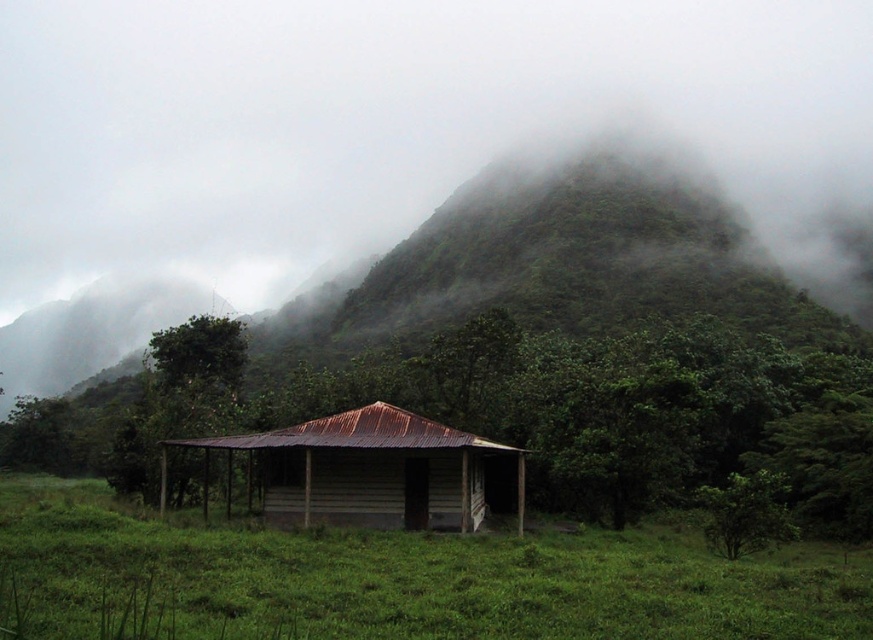
Question: Which of the following is the farthest from the observer?

Choices:
 (A) (418, 424)
 (B) (787, 372)
 (C) (636, 541)

Answer: (B)

Question: Can you confirm if green grassy at center is smaller than green matte mountain at center?

Choices:
 (A) no
 (B) yes

Answer: (B)

Question: Which object appears closest to the camera in this image?

Choices:
 (A) green matte/rough hut at center
 (B) green grassy at center
 (C) rusty corrugated metal cabin at center
 (D) green matte mountain at center

Answer: (B)

Question: Does green matte/rough hut at center come in front of green matte mountain at center?

Choices:
 (A) no
 (B) yes

Answer: (B)

Question: Which of these objects is positioned closest to the green matte/rough hut at center?

Choices:
 (A) green matte mountain at center
 (B) green grassy at center
 (C) rusty corrugated metal cabin at center

Answer: (C)

Question: Does green matte/rough hut at center appear under rusty corrugated metal cabin at center?

Choices:
 (A) no
 (B) yes

Answer: (A)